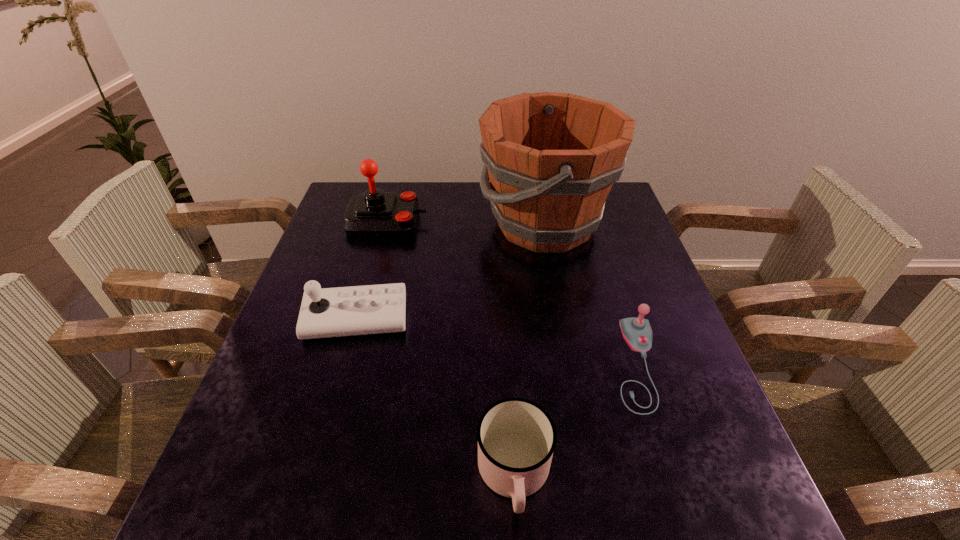
The height and width of the screenshot is (540, 960). Identify the location of free space located 0.120m on the right of the second shortest joystick. (459, 319).

Where is `vacant point located 0.060m on the left of the shortest joystick`? vacant point located 0.060m on the left of the shortest joystick is located at coordinates (585, 364).

The image size is (960, 540). What are the coordinates of `bucket situated at the far edge` in the screenshot? It's located at (551, 158).

This screenshot has height=540, width=960. I want to click on joystick that is positioned at the far edge, so click(x=373, y=213).

The width and height of the screenshot is (960, 540). Identify the location of object that is at the near edge. (516, 437).

Where is `bucket that is at the right edge`? Image resolution: width=960 pixels, height=540 pixels. bucket that is at the right edge is located at coordinates (551, 158).

I want to click on joystick that is at the right edge, so click(x=637, y=332).

This screenshot has height=540, width=960. Find the location of `object that is at the far left corner`. object that is at the far left corner is located at coordinates click(373, 213).

Find the location of a particular element. This screenshot has width=960, height=540. object that is at the far right corner is located at coordinates (551, 158).

In the image, there is a desktop. Where is `free region at the far edge`? This screenshot has height=540, width=960. free region at the far edge is located at coordinates (459, 187).